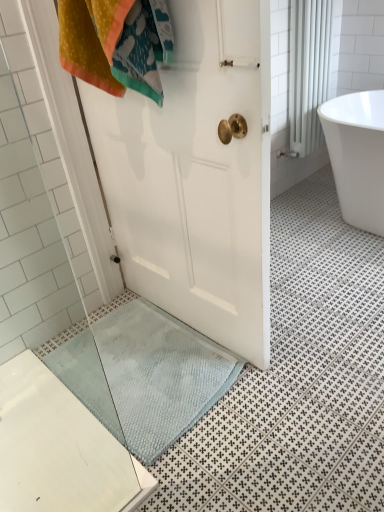
Question: From the image's perspective, is blue textured bath mat at lower center located above or below white glossy bathtub at upper right?

Choices:
 (A) above
 (B) below

Answer: (B)

Question: Considering the positions of point (61, 362) and point (342, 199), is point (61, 362) closer or farther from the camera than point (342, 199)?

Choices:
 (A) farther
 (B) closer

Answer: (B)

Question: Which object is the farthest from the white glossy radiator at upper right?

Choices:
 (A) white glossy bathtub at upper right
 (B) blue textured bath mat at lower center

Answer: (B)

Question: Considering the real-world distances, which object is farthest from the blue textured bath mat at lower center?

Choices:
 (A) white glossy radiator at upper right
 (B) white glossy bathtub at upper right

Answer: (A)